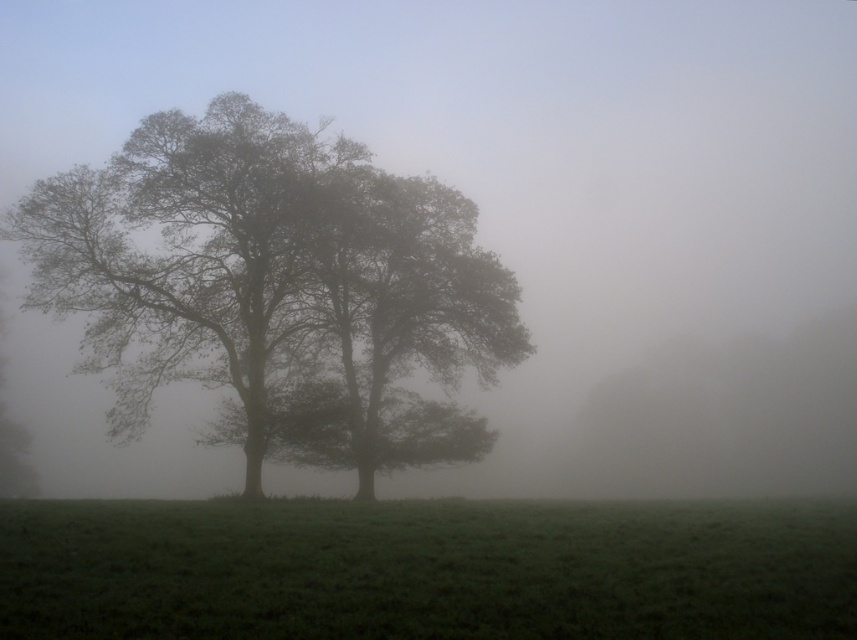
Is point (55, 184) positioned after point (640, 518)?

Yes, point (55, 184) is farther from viewer.

Is point (295, 250) less distant than point (694, 605)?

No, (295, 250) is further to viewer.

Where is `dark gray textured tree at center`? The image size is (857, 640). dark gray textured tree at center is located at coordinates (274, 289).